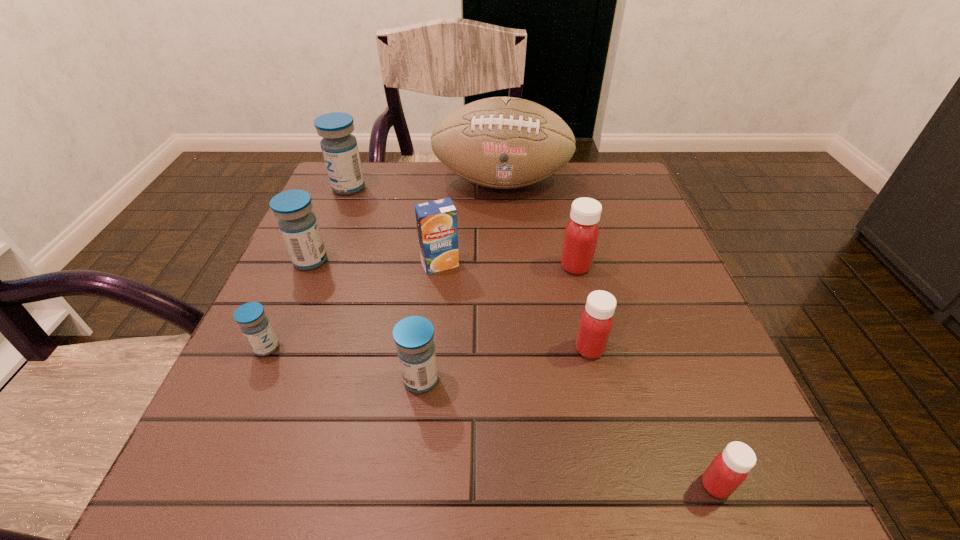
Locate an element on the screen. This screenshot has width=960, height=540. object that ranks as the closest to the rightmost red medicine is located at coordinates (596, 322).

Identify the location of medicine that stands as the fifth closest to the blue orange_juice. (251, 317).

Where is `the second closest medicine to the second biggest red medicine`? the second closest medicine to the second biggest red medicine is located at coordinates (729, 469).

Locate which blue medicine ranks in proximity to the smallest red medicine. Please provide its 2D coordinates. Your answer should be formatted as a tuple, i.e. [(x, y)], where the tuple contains the x and y coordinates of a point satisfying the conditions above.

[(414, 336)]

Point out which blue medicine is positioned as the second nearest to the biggest red medicine. Please provide its 2D coordinates. Your answer should be formatted as a tuple, i.e. [(x, y)], where the tuple contains the x and y coordinates of a point satisfying the conditions above.

[(298, 225)]

This screenshot has width=960, height=540. I want to click on the third closest red medicine to the third smallest blue medicine, so click(x=729, y=469).

Choose which red medicine is the third nearest neighbor to the second farthest blue medicine. Please provide its 2D coordinates. Your answer should be formatted as a tuple, i.e. [(x, y)], where the tuple contains the x and y coordinates of a point satisfying the conditions above.

[(729, 469)]

Locate an element on the screen. free point that satisfies the following two spatial constraints: 1. on the front side of the smallest red medicine; 2. on the left side of the smallest blue medicine is located at coordinates (205, 485).

In order to click on vacant space that satisfies the following two spatial constraints: 1. on the back side of the second smallest blue medicine; 2. on the right side of the farthest red medicine in this screenshot , I will do `click(434, 266)`.

At what (x,y) coordinates should I click in order to perform the action: click on vacant point that satisfies the following two spatial constraints: 1. on the front side of the blue orange_juice; 2. on the left side of the farthest blue medicine. Please return your answer as a coordinate pair (x, y). This screenshot has width=960, height=540. Looking at the image, I should click on (318, 264).